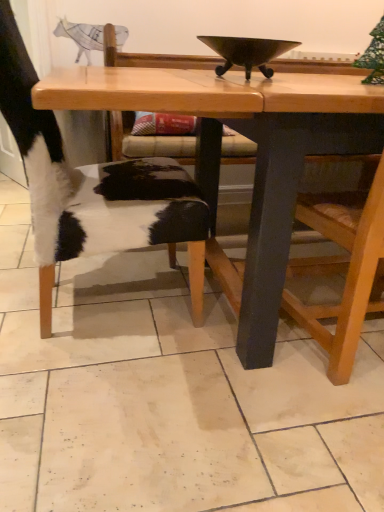
Where is `free space between cowhide leather chair at left and wooden table at center`? This screenshot has height=512, width=384. free space between cowhide leather chair at left and wooden table at center is located at coordinates (36, 364).